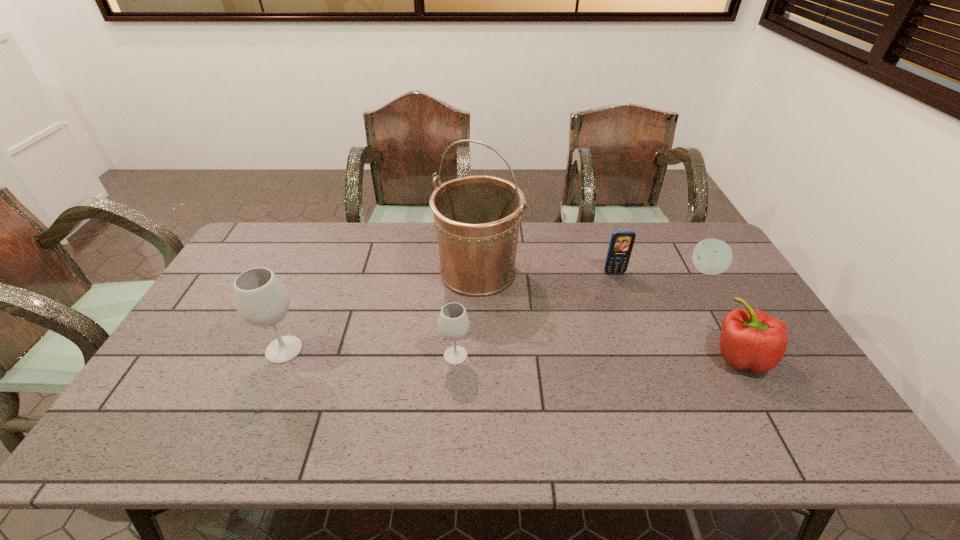
In the image, there is a desktop. Where is `vacant area at the left edge`? This screenshot has height=540, width=960. vacant area at the left edge is located at coordinates (219, 379).

Where is `free point at the far right corner`? free point at the far right corner is located at coordinates (684, 234).

Where is `vacant point located between the shortest object and the bell pepper`? This screenshot has width=960, height=540. vacant point located between the shortest object and the bell pepper is located at coordinates (724, 313).

Find the location of a particular element. The width and height of the screenshot is (960, 540). vacant space that's between the third object from right to left and the bucket is located at coordinates (546, 272).

Identify the location of unoccupied position between the right wineglass and the apple. The width and height of the screenshot is (960, 540). (582, 313).

The height and width of the screenshot is (540, 960). In order to click on vacant area between the tallest object and the cellular telephone in this screenshot , I will do `click(546, 272)`.

Locate an element on the screen. vacant area that lies between the bell pepper and the shortest object is located at coordinates (724, 313).

Find the location of a particular element. vacant point located between the cellular telephone and the shorter wineglass is located at coordinates (535, 314).

Locate an element on the screen. The height and width of the screenshot is (540, 960). free space between the cellular telephone and the bell pepper is located at coordinates (678, 315).

Find the location of `free area in between the cellular telephone and the bell pepper`. free area in between the cellular telephone and the bell pepper is located at coordinates (678, 315).